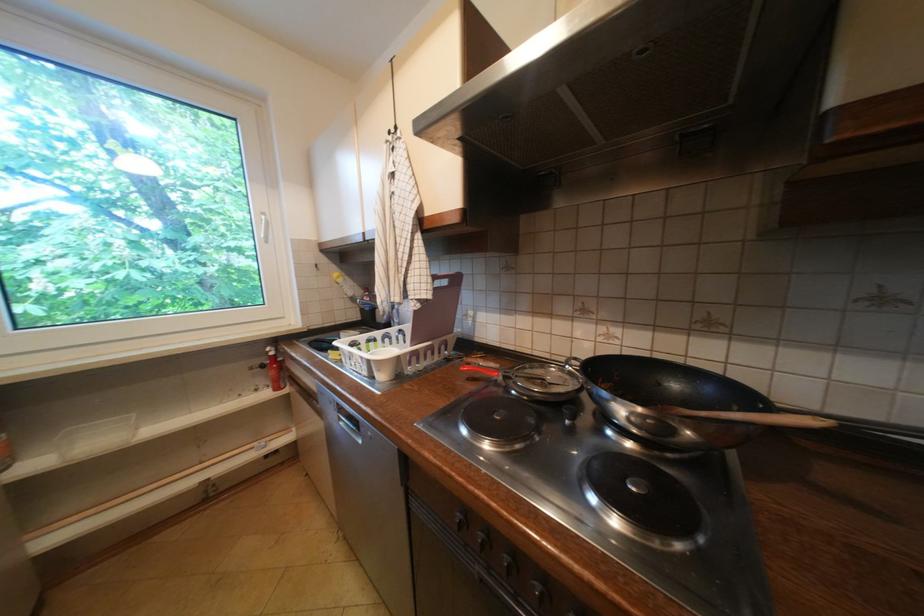
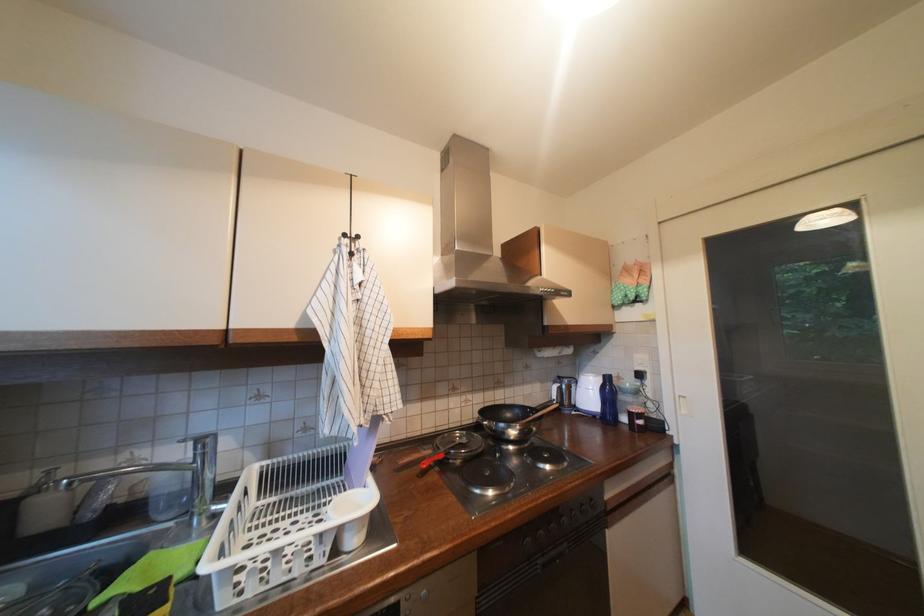
Question: Based on the continuous images, in which direction is the camera rotating? Reply with the corresponding letter.

Choices:
 (A) Left
 (B) Right
 (C) Up
 (D) Down

Answer: (B)